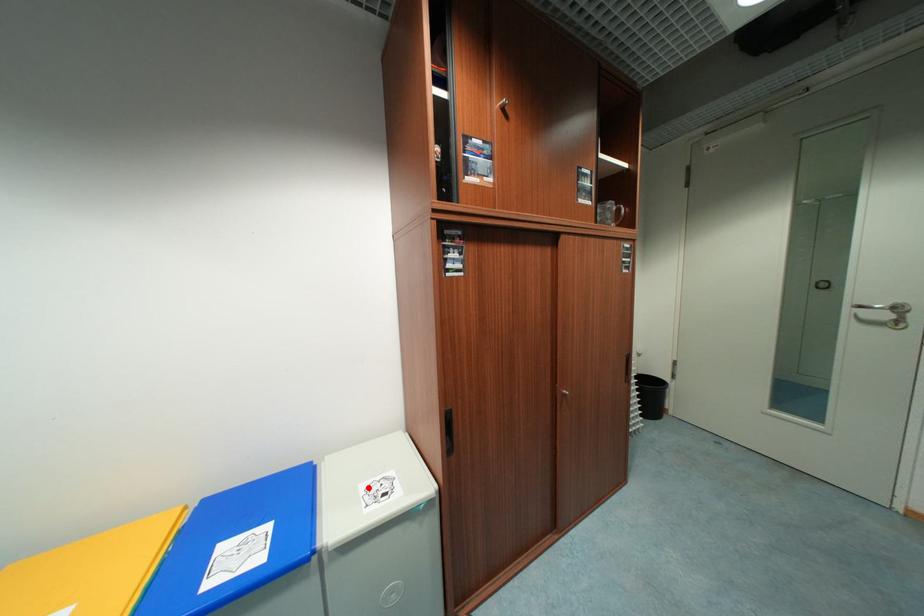
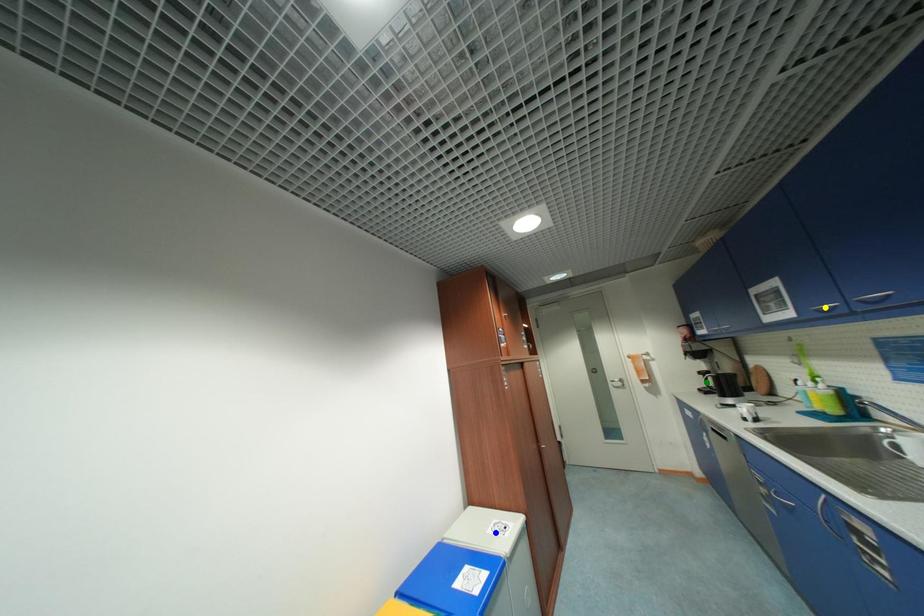
Question: I am providing you with two images of the same scene from different viewpoints. A red point is marked on the first image. You are given multiple points on the second image. Which point in image 2 is actually the same real-world point as the red point in image 1?

Choices:
 (A) green point
 (B) yellow point
 (C) blue point

Answer: (C)